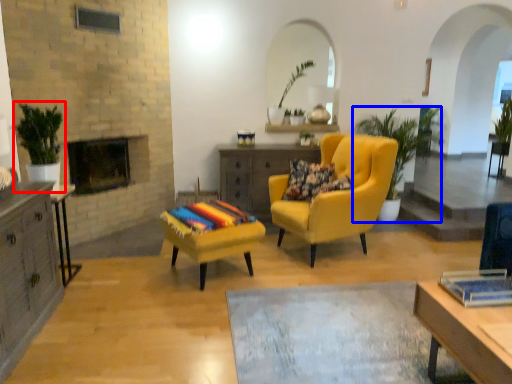
Question: Which object is closer to the camera taking this photo, houseplant (highlighted by a red box) or houseplant (highlighted by a blue box)?

Choices:
 (A) houseplant
 (B) houseplant

Answer: (A)